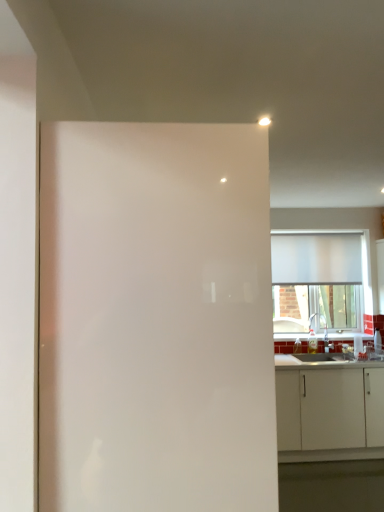
Question: Is white matte window at upper right wider than white glossy countertop at lower right?

Choices:
 (A) no
 (B) yes

Answer: (A)

Question: Is white matte window at upper right oriented away from white glossy countertop at lower right?

Choices:
 (A) yes
 (B) no

Answer: (B)

Question: Can you confirm if white matte window at upper right is shorter than white glossy countertop at lower right?

Choices:
 (A) no
 (B) yes

Answer: (A)

Question: Can you confirm if white matte window at upper right is positioned to the right of white glossy countertop at lower right?

Choices:
 (A) no
 (B) yes

Answer: (A)

Question: Can you confirm if white matte window at upper right is positioned to the left of white glossy countertop at lower right?

Choices:
 (A) no
 (B) yes

Answer: (B)

Question: From the image's perspective, is white matte window at upper right over white glossy countertop at lower right?

Choices:
 (A) yes
 (B) no

Answer: (A)

Question: Considering the relative sizes of white glossy screen door at center and white glossy countertop at lower right in the image provided, is white glossy screen door at center taller than white glossy countertop at lower right?

Choices:
 (A) no
 (B) yes

Answer: (B)

Question: Can you confirm if white glossy screen door at center is positioned to the left of white glossy countertop at lower right?

Choices:
 (A) yes
 (B) no

Answer: (A)

Question: Is white glossy screen door at center located outside white glossy countertop at lower right?

Choices:
 (A) yes
 (B) no

Answer: (A)

Question: From a real-world perspective, does white glossy screen door at center sit lower than white glossy countertop at lower right?

Choices:
 (A) no
 (B) yes

Answer: (A)

Question: Is white glossy screen door at center further to the viewer compared to white glossy countertop at lower right?

Choices:
 (A) no
 (B) yes

Answer: (A)

Question: Is white glossy countertop at lower right inside white glossy screen door at center?

Choices:
 (A) no
 (B) yes

Answer: (A)

Question: Does white matte cabinet at lower right turn towards white glossy screen door at center?

Choices:
 (A) yes
 (B) no

Answer: (A)